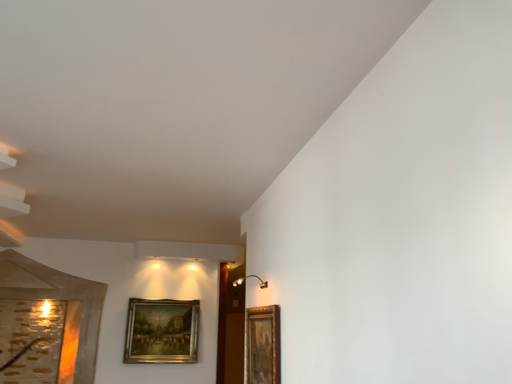
Question: Is gold-framed painting at center-left, the 2th picture frame viewed from the right, not near gold-toned wooden picture frame at right, positioned as the 1th picture frame in top-to-bottom order?

Choices:
 (A) no
 (B) yes

Answer: (B)

Question: Can you confirm if gold-framed painting at center-left, the first picture frame positioned from the bottom, is positioned to the left of gold-toned wooden picture frame at right, the second picture frame when ordered from back to front?

Choices:
 (A) yes
 (B) no

Answer: (A)

Question: Is gold-framed painting at center-left, the first picture frame positioned from the bottom, closer to the viewer compared to gold-toned wooden picture frame at right, the second picture frame when ordered from back to front?

Choices:
 (A) no
 (B) yes

Answer: (A)

Question: Can you confirm if gold-framed painting at center-left, placed as the 2th picture frame when sorted from front to back, is positioned to the right of gold-toned wooden picture frame at right, positioned as the 1th picture frame in front-to-back order?

Choices:
 (A) yes
 (B) no

Answer: (B)

Question: Can you confirm if gold-framed painting at center-left, acting as the 1th picture frame starting from the left, is wider than gold-toned wooden picture frame at right, which is the 1th picture frame from right to left?

Choices:
 (A) no
 (B) yes

Answer: (B)

Question: Is gold-framed painting at center-left, the 2th picture frame viewed from the right, thinner than gold-toned wooden picture frame at right, arranged as the 2th picture frame when ordered from the bottom?

Choices:
 (A) yes
 (B) no

Answer: (B)

Question: Can you confirm if gold-toned wooden picture frame at right, which is counted as the 2th picture frame, starting from the left, is wider than gold-framed painting at center-left, the 2th picture frame positioned from the top?

Choices:
 (A) no
 (B) yes

Answer: (A)

Question: Considering the relative sizes of gold-toned wooden picture frame at right, the second picture frame when ordered from back to front, and gold-framed painting at center-left, the first picture frame positioned from the bottom, in the image provided, is gold-toned wooden picture frame at right, the second picture frame when ordered from back to front, shorter than gold-framed painting at center-left, the first picture frame positioned from the bottom,?

Choices:
 (A) yes
 (B) no

Answer: (A)

Question: Is gold-toned wooden picture frame at right, positioned as the 1th picture frame in front-to-back order, positioned behind gold-framed painting at center-left, the 2th picture frame viewed from the right?

Choices:
 (A) yes
 (B) no

Answer: (B)

Question: Is there a large distance between gold-toned wooden picture frame at right, the second picture frame when ordered from back to front, and gold-framed painting at center-left, the first picture frame viewed from the back?

Choices:
 (A) yes
 (B) no

Answer: (A)

Question: Is gold-framed painting at center-left, the 2th picture frame viewed from the right, located within gold-toned wooden picture frame at right, arranged as the 2th picture frame when ordered from the bottom?

Choices:
 (A) yes
 (B) no

Answer: (B)

Question: Considering the relative positions of gold-toned wooden picture frame at right, arranged as the 2th picture frame when ordered from the bottom, and gold-framed painting at center-left, the first picture frame positioned from the bottom, in the image provided, is gold-toned wooden picture frame at right, arranged as the 2th picture frame when ordered from the bottom, to the right of gold-framed painting at center-left, the first picture frame positioned from the bottom, from the viewer's perspective?

Choices:
 (A) no
 (B) yes

Answer: (B)

Question: From the image's perspective, is gold-toned wooden picture frame at right, which is the 1th picture frame from right to left, above or below gold-framed painting at center-left, acting as the 1th picture frame starting from the left?

Choices:
 (A) above
 (B) below

Answer: (A)